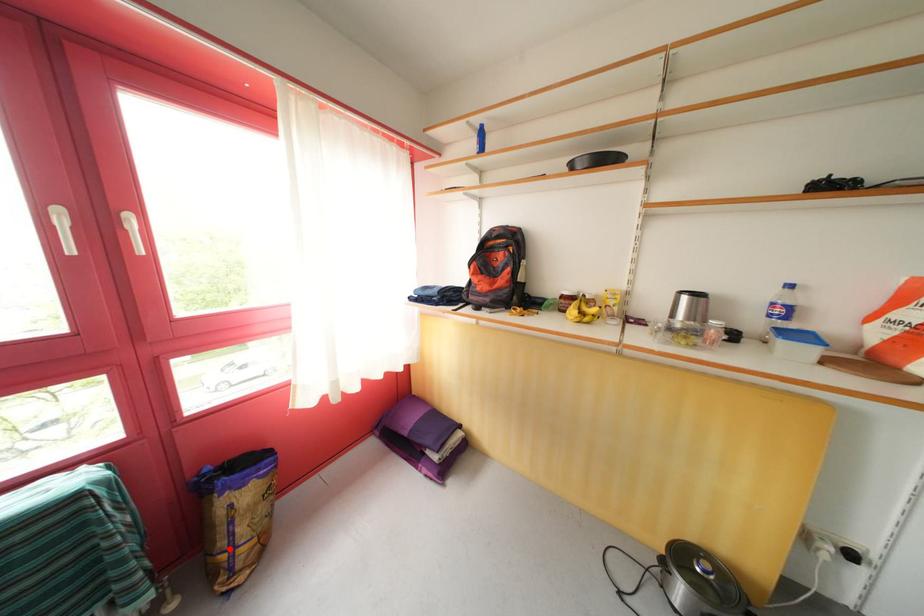
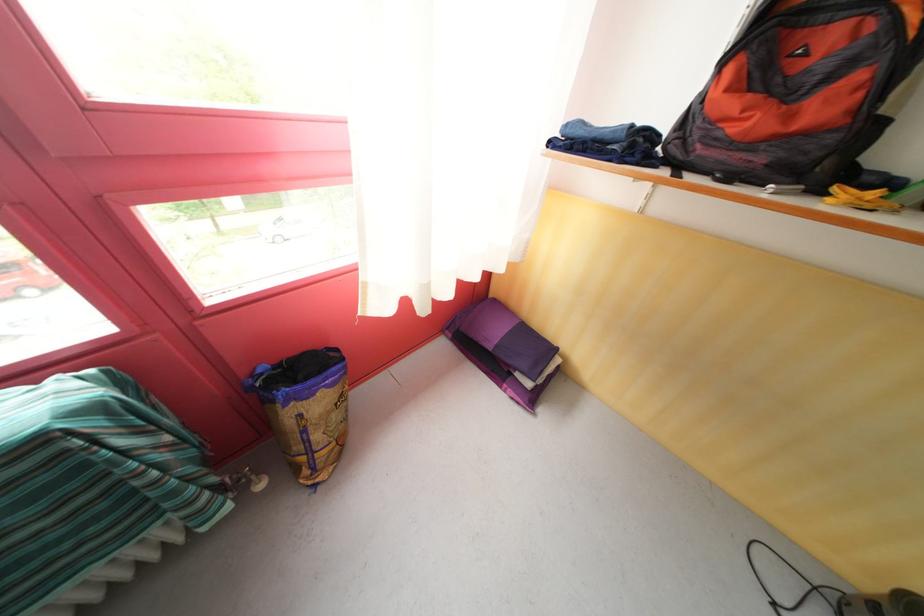
The point at the highlighted location is marked in the first image. Where is the corresponding point in the second image?

(305, 454)